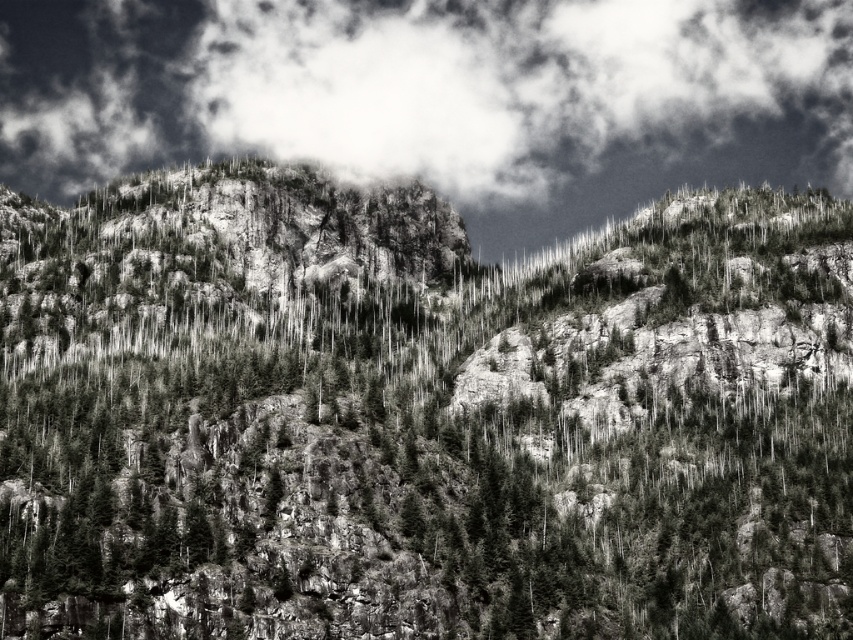
Based on the scene described, which object, the dark gray textured rock at center or the white fluffy cloud at upper center, occupies a larger area in the image?

The white fluffy cloud at upper center occupies a larger area in the image because the dark gray textured rock at center has a smaller size compared to it.